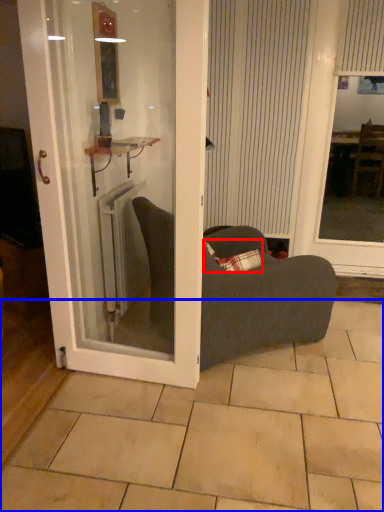
Question: Which point is closer to the camera, pillow (highlighted by a red box) or tile (highlighted by a blue box)?

Choices:
 (A) pillow
 (B) tile

Answer: (B)